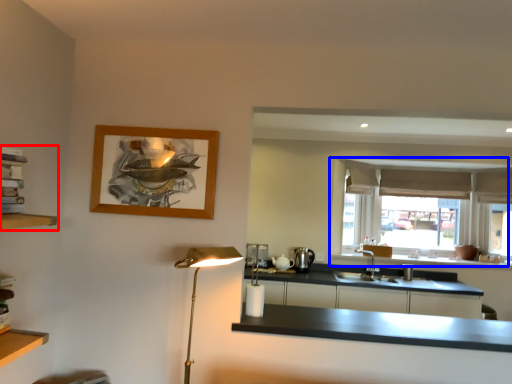
Question: Which point is further to the camera, shelf (highlighted by a red box) or window (highlighted by a blue box)?

Choices:
 (A) shelf
 (B) window

Answer: (B)